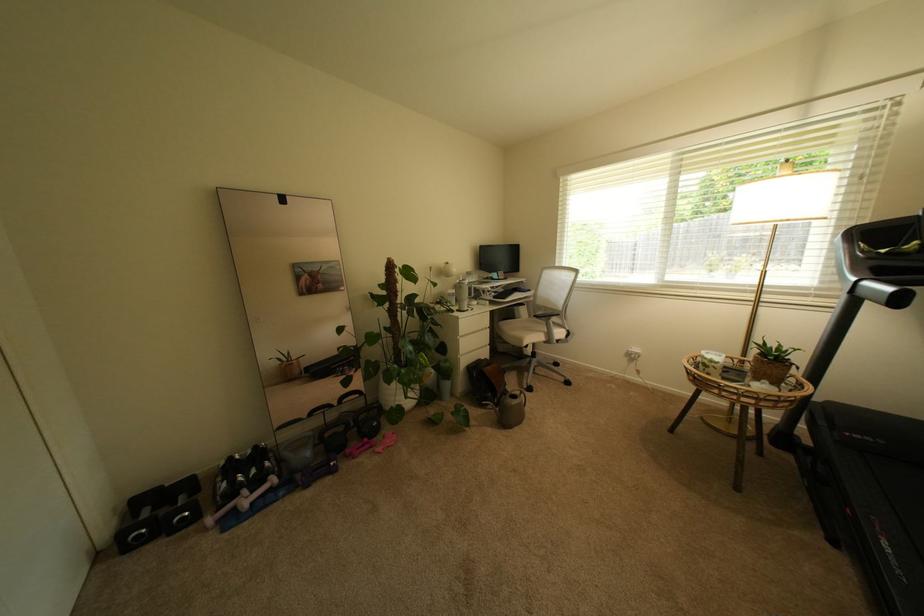
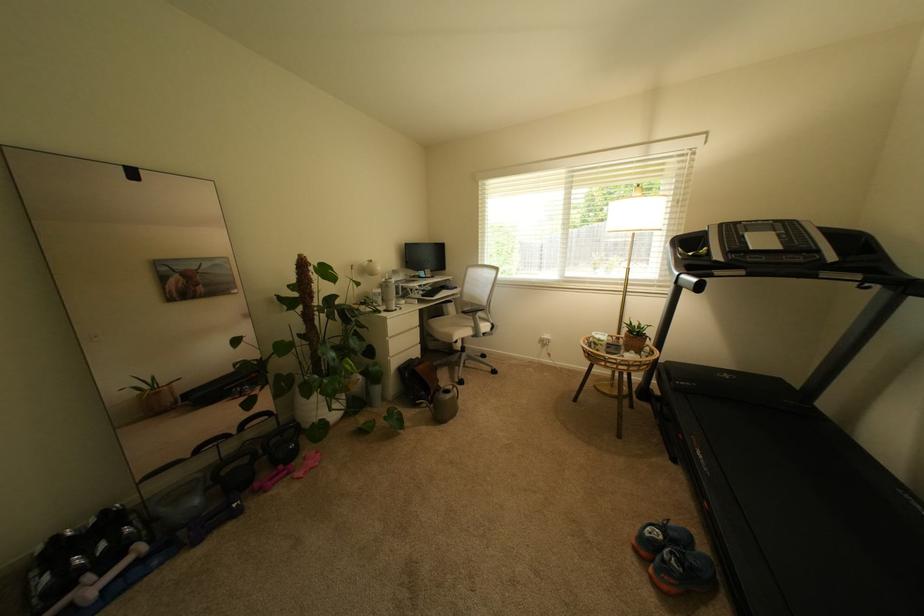
Question: Which direction would the cameraman need to move to produce the second image? Reply with the corresponding letter.

Choices:
 (A) Left
 (B) Right
 (C) Forward
 (D) Backward

Answer: (A)